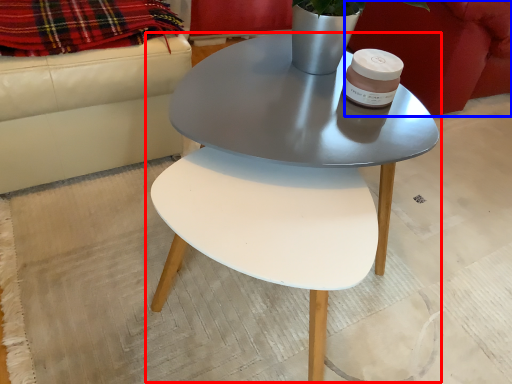
Question: Among these objects, which one is nearest to the camera, coffee table (highlighted by a red box) or armchair (highlighted by a blue box)?

Choices:
 (A) coffee table
 (B) armchair

Answer: (A)